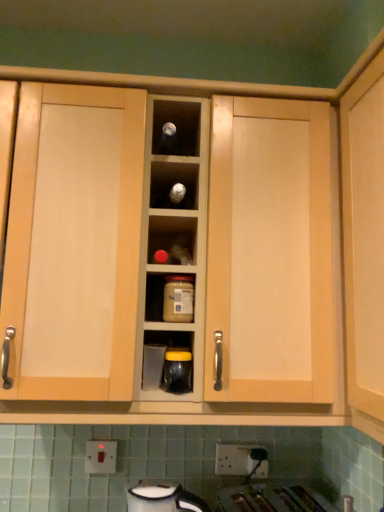
Question: Based on their positions, is black glossy jar at center, positioned as the third appliance in bottom-to-top order, located to the left or right of white plastic electric outlet at lower center, which ranks as the 2th electric outlet in right-to-left order?

Choices:
 (A) right
 (B) left

Answer: (A)

Question: From a real-world perspective, is black glossy jar at center, the first appliance viewed from the top, physically located above or below white plastic electric outlet at lower center, the 1th electric outlet in the left-to-right sequence?

Choices:
 (A) above
 (B) below

Answer: (A)

Question: Which is nearer to the matte glass jar at center?

Choices:
 (A) white glossy kettle at lower center, placed as the 1th appliance when sorted from bottom to top
 (B) matte plastic container at center, the 2th appliance viewed from the top
 (C) white plastic electric outlet at lower center, which appears as the first electric outlet when viewed from the right
 (D) white plastic electric outlet at lower center, the 1th electric outlet in the left-to-right sequence
 (E) black glossy jar at center, the first appliance viewed from the top

Answer: (E)

Question: Estimate the real-world distances between objects in this image. Which object is closer to the black glossy jar at center, the first appliance viewed from the top?

Choices:
 (A) matte glass jar at center
 (B) white plastic electric outlet at lower center, the 1th electric outlet in the left-to-right sequence
 (C) white glossy kettle at lower center, the third appliance in the top-to-bottom sequence
 (D) white plastic electric outlet at lower center, which appears as the first electric outlet when viewed from the right
 (E) matte plastic container at center, arranged as the second appliance when ordered from the bottom

Answer: (E)